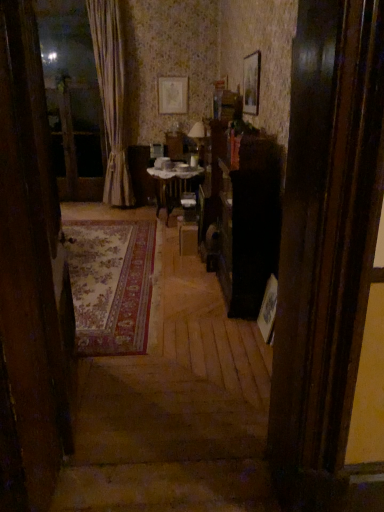
Question: Is wooden table at center closer to the viewer compared to wooden picture frame at upper center, which ranks as the 1th picture frame in bottom-to-top order?

Choices:
 (A) yes
 (B) no

Answer: (B)

Question: From the image's perspective, is wooden table at center located beneath wooden picture frame at upper center, the first picture frame in the front-to-back sequence?

Choices:
 (A) yes
 (B) no

Answer: (A)

Question: Can you confirm if wooden table at center is thinner than wooden picture frame at upper center, the second picture frame from the top?

Choices:
 (A) yes
 (B) no

Answer: (B)

Question: Are wooden table at center and wooden picture frame at upper center, the first picture frame in the front-to-back sequence, located far from each other?

Choices:
 (A) no
 (B) yes

Answer: (B)

Question: Are wooden table at center and wooden picture frame at upper center, the 1th picture frame from the right, beside each other?

Choices:
 (A) yes
 (B) no

Answer: (B)

Question: Is wooden table at center further to camera compared to wooden picture frame at upper center, which is counted as the second picture frame, starting from the back?

Choices:
 (A) yes
 (B) no

Answer: (A)

Question: Is the depth of wooden picture frame at upper center, the second picture frame from the top, greater than that of carpeted rug at left?

Choices:
 (A) no
 (B) yes

Answer: (B)

Question: Is carpeted rug at left a part of wooden picture frame at upper center, the first picture frame in the front-to-back sequence?

Choices:
 (A) no
 (B) yes

Answer: (A)

Question: From a real-world perspective, does wooden picture frame at upper center, which ranks as the 1th picture frame in bottom-to-top order, stand above carpeted rug at left?

Choices:
 (A) yes
 (B) no

Answer: (A)

Question: From the image's perspective, is wooden picture frame at upper center, which is the second picture frame from left to right, under carpeted rug at left?

Choices:
 (A) yes
 (B) no

Answer: (B)

Question: Is wooden picture frame at upper center, which is the second picture frame from left to right, to the left of carpeted rug at left from the viewer's perspective?

Choices:
 (A) yes
 (B) no

Answer: (B)

Question: Considering the relative sizes of wooden picture frame at upper center, the first picture frame in the front-to-back sequence, and carpeted rug at left in the image provided, is wooden picture frame at upper center, the first picture frame in the front-to-back sequence, smaller than carpeted rug at left?

Choices:
 (A) yes
 (B) no

Answer: (A)

Question: Considering the relative sizes of silky beige curtain at left and wooden picture frame at upper center, which is the second picture frame from left to right, in the image provided, is silky beige curtain at left thinner than wooden picture frame at upper center, which is the second picture frame from left to right,?

Choices:
 (A) no
 (B) yes

Answer: (A)